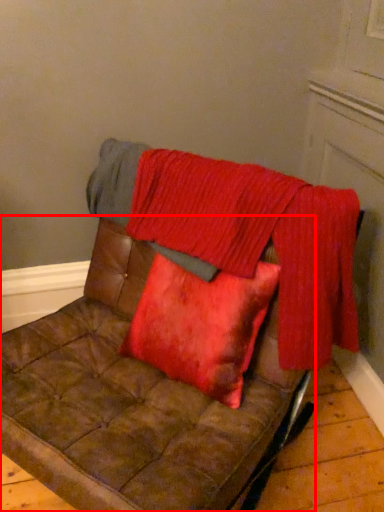
Question: Where is furniture (annotated by the red box) located in relation to blanket in the image?

Choices:
 (A) right
 (B) left

Answer: (B)